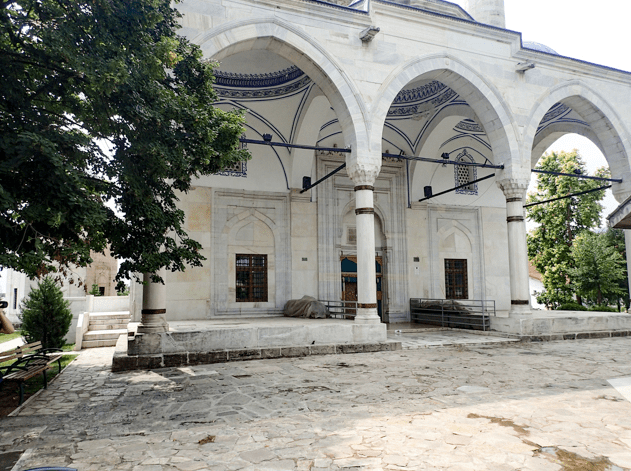
The width and height of the screenshot is (631, 471). Find the location of `window`. window is located at coordinates (249, 280), (461, 287).